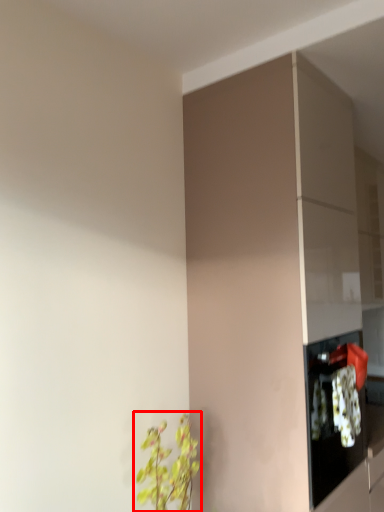
Question: From the image, what is the correct spatial relationship of houseplant (annotated by the red box) in relation to cabinetry?

Choices:
 (A) left
 (B) right

Answer: (A)